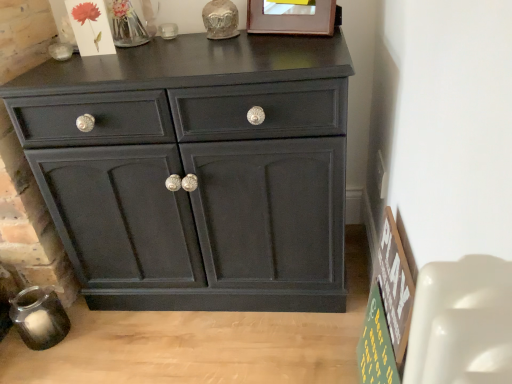
Where is `green wooden signboard at lower right`? The image size is (512, 384). green wooden signboard at lower right is located at coordinates (387, 311).

Where is `green wooden signboard at lower right`? Image resolution: width=512 pixels, height=384 pixels. green wooden signboard at lower right is located at coordinates (387, 311).

Considering the sizes of objects green wooden signboard at lower right and matte black cabinet at center in the image provided, who is thinner, green wooden signboard at lower right or matte black cabinet at center?

green wooden signboard at lower right is thinner.

Can you confirm if green wooden signboard at lower right is positioned to the left of matte black cabinet at center?

Incorrect, green wooden signboard at lower right is not on the left side of matte black cabinet at center.

Could matte black cabinet at center be considered to be inside green wooden signboard at lower right?

No, green wooden signboard at lower right does not contain matte black cabinet at center.

Between green wooden signboard at lower right and matte black cabinet at center, which one is positioned behind?

matte black cabinet at center is further from the camera.

Can you confirm if matte black cabinet at center is shorter than wooden picture frame at upper center?

No.

Which is more to the right, matte black cabinet at center or wooden picture frame at upper center?

wooden picture frame at upper center.

Find the location of a particular element. The image size is (512, 384). picture frame that is above the matte black cabinet at center (from a real-world perspective) is located at coordinates point(291,17).

Measure the distance between matte black cabinet at center and wooden picture frame at upper center.

matte black cabinet at center and wooden picture frame at upper center are 19.45 inches apart from each other.

From a real-world perspective, is wooden picture frame at upper center positioned under matte black cabinet at center based on gravity?

No, from a real-world perspective, wooden picture frame at upper center is not beneath matte black cabinet at center.

From the image's perspective, is wooden picture frame at upper center below matte black cabinet at center?

No, from the image's perspective, wooden picture frame at upper center is not below matte black cabinet at center.

Which is nearer, (325, 10) or (157, 60)?

The point (157, 60) is closer to the camera.

In order to click on the chest of drawers that appears above the green wooden signboard at lower right (from the image's perspective) in this screenshot , I will do `click(196, 171)`.

From a real-world perspective, who is located lower, matte black cabinet at center or green wooden signboard at lower right?

green wooden signboard at lower right is physically lower.

How many degrees apart are the facing directions of matte black cabinet at center and green wooden signboard at lower right?

matte black cabinet at center and green wooden signboard at lower right are facing 88.9 degrees away from each other.

From the image's perspective, is matte black cabinet at center above green wooden signboard at lower right?

Indeed, from the image's perspective, matte black cabinet at center is shown above green wooden signboard at lower right.

Locate an element on the screen. Image resolution: width=512 pixels, height=384 pixels. picture frame above the green wooden signboard at lower right (from the image's perspective) is located at coordinates (291, 17).

Does green wooden signboard at lower right turn towards wooden picture frame at upper center?

No.

In the image, is green wooden signboard at lower right on the left side or the right side of wooden picture frame at upper center?

In the image, green wooden signboard at lower right appears on the right side of wooden picture frame at upper center.

Which point is more forward, [274,22] or [398,234]?

The point [398,234] is in front.

Is wooden picture frame at upper center aimed at green wooden signboard at lower right?

No, wooden picture frame at upper center is not aimed at green wooden signboard at lower right.

Can we say wooden picture frame at upper center lies outside green wooden signboard at lower right?

That's correct, wooden picture frame at upper center is outside of green wooden signboard at lower right.

Can you confirm if wooden picture frame at upper center is positioned to the left of green wooden signboard at lower right?

Indeed, wooden picture frame at upper center is positioned on the left side of green wooden signboard at lower right.

In order to click on bulletin board that appears in front of the matte black cabinet at center in this screenshot , I will do `click(387, 311)`.

At what (x,y) coordinates should I click in order to perform the action: click on chest of drawers on the left of the wooden picture frame at upper center. Please return your answer as a coordinate pair (x, y). Looking at the image, I should click on (196, 171).

Which object lies nearer to the anchor point wooden picture frame at upper center, green wooden signboard at lower right or matte black cabinet at center?

matte black cabinet at center is positioned closer to the anchor wooden picture frame at upper center.

Looking at the image, which one is located closer to matte black cabinet at center, wooden picture frame at upper center or green wooden signboard at lower right?

green wooden signboard at lower right is closer to matte black cabinet at center.

From the image, which object appears to be farther from matte black cabinet at center, green wooden signboard at lower right or wooden picture frame at upper center?

wooden picture frame at upper center.

Which object lies further to the anchor point green wooden signboard at lower right, matte black cabinet at center or wooden picture frame at upper center?

wooden picture frame at upper center is positioned further to the anchor green wooden signboard at lower right.

Estimate the real-world distances between objects in this image. Which object is closer to wooden picture frame at upper center, matte black cabinet at center or green wooden signboard at lower right?

matte black cabinet at center lies closer to wooden picture frame at upper center than the other object.

Considering their positions, is wooden picture frame at upper center positioned closer to green wooden signboard at lower right than matte black cabinet at center?

matte black cabinet at center.

This screenshot has width=512, height=384. Identify the location of chest of drawers between wooden picture frame at upper center and green wooden signboard at lower right in the up-down direction. (196, 171).